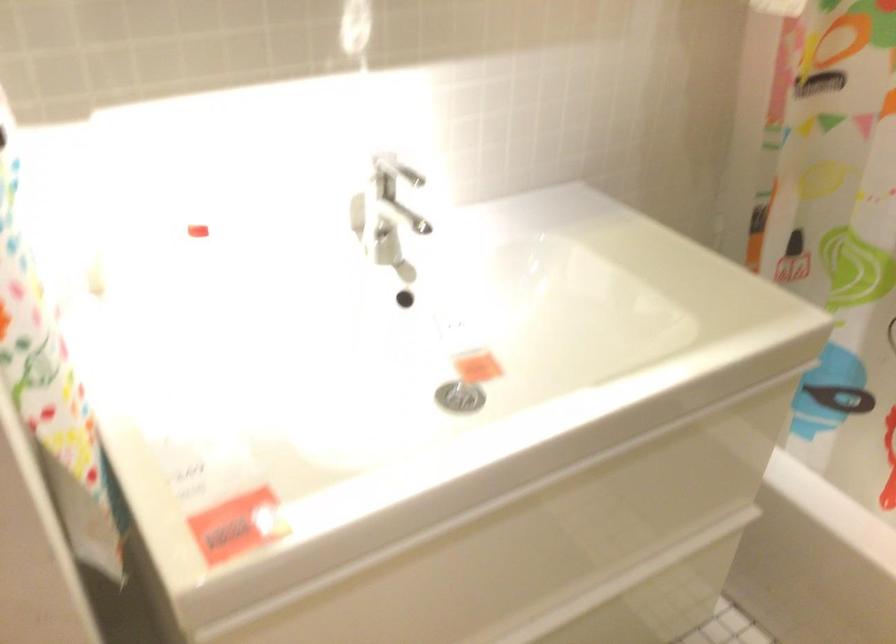
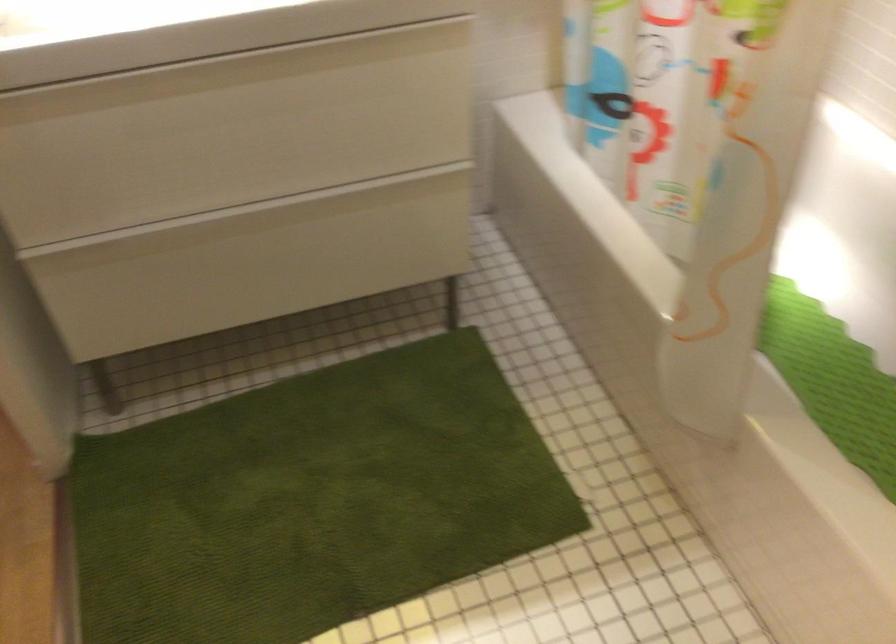
The point at [564,477] is marked in the first image. Where is the corresponding point in the second image?

(228, 70)